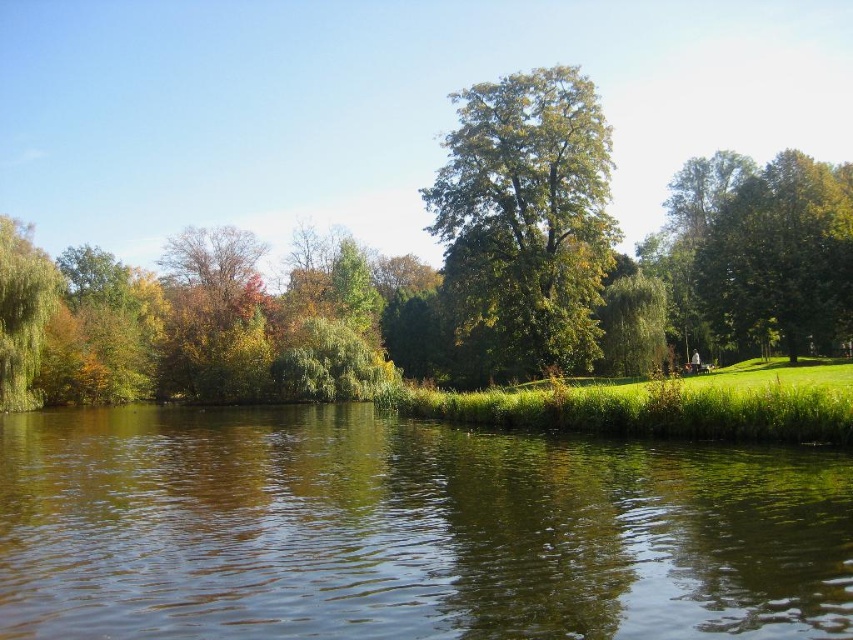
Can you confirm if green grassy bank at lower center is wider than green leafy tree at left?

Yes.

Is point (821, 577) positioned before point (9, 376)?

Yes, point (821, 577) is in front of point (9, 376).

Where is `green grassy bank at lower center`? The height and width of the screenshot is (640, 853). green grassy bank at lower center is located at coordinates (408, 531).

Is green leafy tree at center to the right of green leafy tree at upper right from the viewer's perspective?

Incorrect, green leafy tree at center is not on the right side of green leafy tree at upper right.

Is point (577, 204) positioned behind point (850, 170)?

That is False.

Identify the location of green leafy tree at center. (527, 214).

Which is above, green leafy tree at upper right or green leafy tree at left?

green leafy tree at upper right is higher up.

Can you confirm if green leafy tree at upper right is wider than green leafy tree at left?

No, green leafy tree at upper right is not wider than green leafy tree at left.

Find the location of `green leafy tree at upper right`. green leafy tree at upper right is located at coordinates (780, 257).